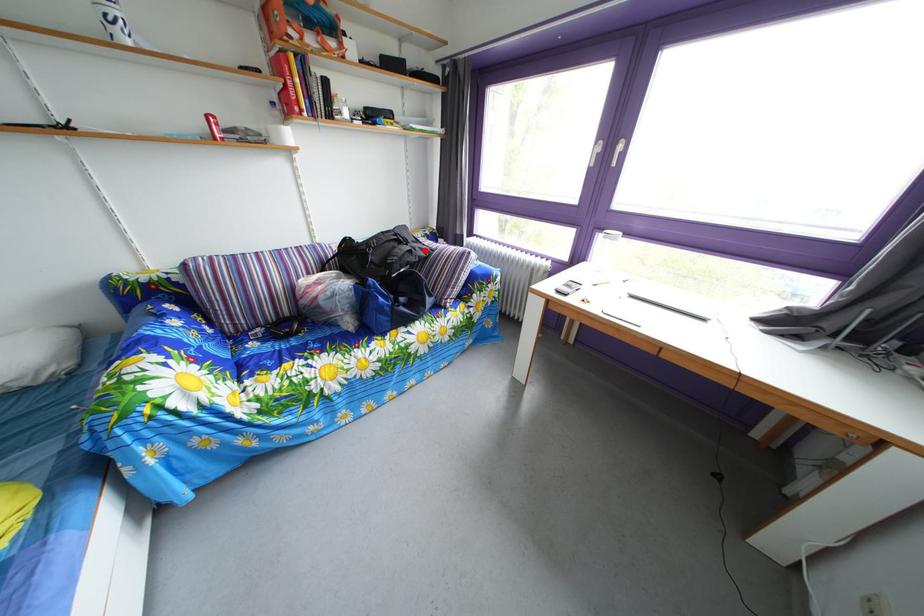
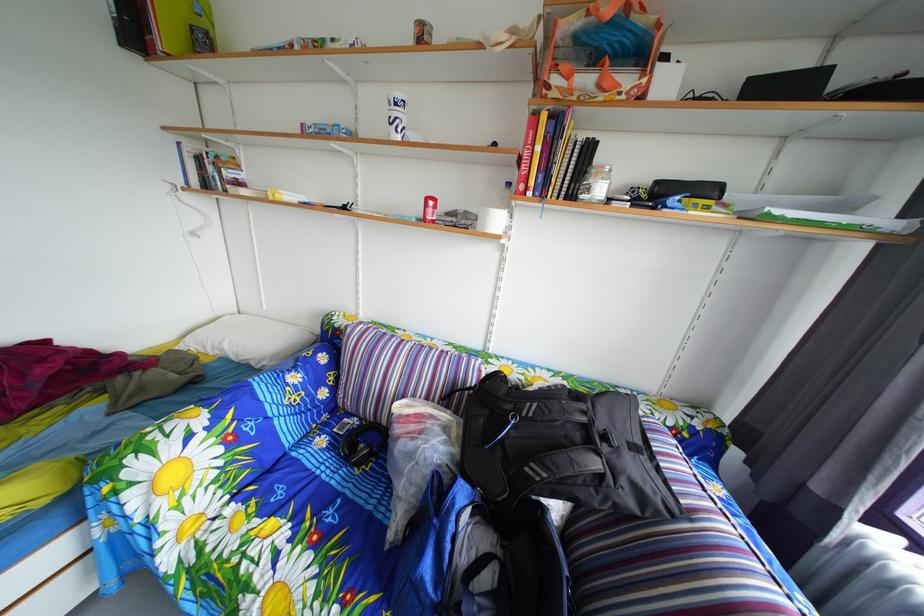
In the second image, find the point that corresponds to the highlighted location in the first image.

(643, 456)